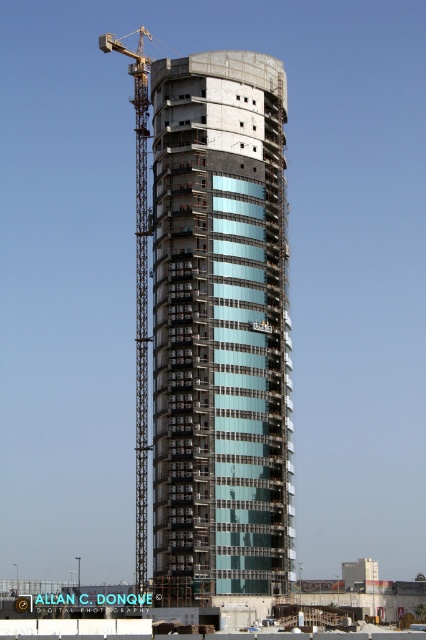
Which of these two, clear glass building at center or transparent glass building at center, stands shorter?

transparent glass building at center is shorter.

Does clear glass building at center appear under transparent glass building at center?

No, clear glass building at center is not below transparent glass building at center.

The width and height of the screenshot is (426, 640). Describe the element at coordinates (219, 330) in the screenshot. I see `clear glass building at center` at that location.

This screenshot has width=426, height=640. In order to click on clear glass building at center in this screenshot , I will do `click(219, 330)`.

Between clear glass building at center and yellow metal crane at left, which one appears on the right side from the viewer's perspective?

clear glass building at center

Which is more to the left, clear glass building at center or yellow metal crane at left?

From the viewer's perspective, yellow metal crane at left appears more on the left side.

Locate an element on the screen. clear glass building at center is located at coordinates (219, 330).

Between yellow metal crane at left and transparent glass building at center, which one is positioned lower?

Positioned lower is transparent glass building at center.

Which is more to the left, yellow metal crane at left or transparent glass building at center?

yellow metal crane at left is more to the left.

Between point (146, 381) and point (100, 620), which one is positioned in front?

Point (100, 620)

At what (x,y) coordinates should I click in order to perform the action: click on yellow metal crane at left. Please return your answer as a coordinate pair (x, y). This screenshot has height=640, width=426. Looking at the image, I should click on (140, 284).